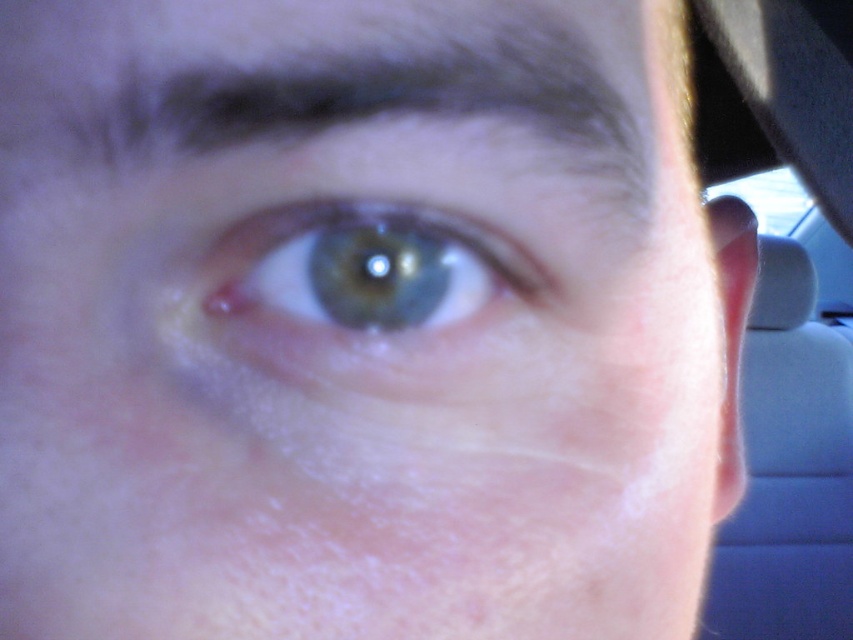
How far apart are dark brown hair at upper center and green matte eye at center?

dark brown hair at upper center and green matte eye at center are 1.03 inches apart.

Can you confirm if dark brown hair at upper center is thinner than green matte eye at center?

Incorrect, dark brown hair at upper center's width is not less than green matte eye at center's.

The width and height of the screenshot is (853, 640). Describe the element at coordinates (354, 76) in the screenshot. I see `dark brown hair at upper center` at that location.

Where is `dark brown hair at upper center`? This screenshot has width=853, height=640. dark brown hair at upper center is located at coordinates (354, 76).